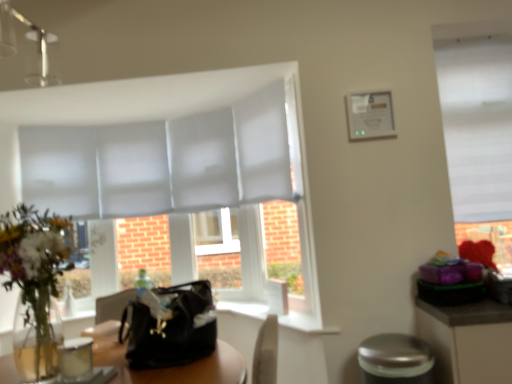
Describe the element at coordinates (305, 324) in the screenshot. I see `white smooth window sill at center` at that location.

At what (x,y) coordinates should I click in order to perform the action: click on translucent glass vase at left. Please return your answer as a coordinate pair (x, y). Looking at the image, I should click on (35, 280).

What do you see at coordinates (35, 280) in the screenshot? This screenshot has height=384, width=512. I see `translucent glass vase at left` at bounding box center [35, 280].

Describe the element at coordinates (478, 127) in the screenshot. The image size is (512, 384). I see `white matte window at upper right` at that location.

Locate an element on the screen. silver metallic bar stool at lower right is located at coordinates (395, 359).

Find the location of a particular element. Image resolution: width=512 pixels, height=384 pixels. white smooth window sill at center is located at coordinates (305, 324).

Can you confirm if black leather handbag at center is taller than translucent glass vase at left?

Incorrect, the height of black leather handbag at center is not larger of that of translucent glass vase at left.

Would you say black leather handbag at center contains translucent glass vase at left?

No, translucent glass vase at left is not inside black leather handbag at center.

Consider the image. Considering the relative sizes of black leather handbag at center and translucent glass vase at left in the image provided, is black leather handbag at center smaller than translucent glass vase at left?

Correct, black leather handbag at center occupies less space than translucent glass vase at left.

Is black leather handbag at center far from translucent glass vase at left?

No, there isn't a large distance between black leather handbag at center and translucent glass vase at left.

From the image's perspective, between white matte window at upper right and black leather handbag at center, which one is located above?

white matte window at upper right appears higher in the image.

Which point is more forward, (479, 148) or (202, 280)?

The point (202, 280) is more forward.

From a real-world perspective, is white matte window at upper right below black leather handbag at center?

No, from a real-world perspective, white matte window at upper right is not beneath black leather handbag at center.

In the scene shown: Is white matte window at upper right wider or thinner than black leather handbag at center?

Clearly, white matte window at upper right has less width compared to black leather handbag at center.

From a real-world perspective, relative to white matte window at upper right, is silver metallic bar stool at lower right vertically above or below?

silver metallic bar stool at lower right is situated lower than white matte window at upper right in the real world.

Consider the image. How many degrees apart are the facing directions of silver metallic bar stool at lower right and white matte window at upper right?

The angle between the facing direction of silver metallic bar stool at lower right and the facing direction of white matte window at upper right is 0.185 degrees.

Is the surface of silver metallic bar stool at lower right in direct contact with white matte window at upper right?

There is a gap between silver metallic bar stool at lower right and white matte window at upper right.

Are white smooth window sill at center and black leather handbag at center beside each other?

No, white smooth window sill at center is not beside black leather handbag at center.

Between white smooth window sill at center and black leather handbag at center, which one has less height?

Standing shorter between the two is white smooth window sill at center.

Is white smooth window sill at center smaller than black leather handbag at center?

Correct, white smooth window sill at center occupies less space than black leather handbag at center.

Is point (327, 328) farther from camera compared to point (196, 285)?

Yes, it is behind point (196, 285).

Could black leather handbag at center be considered to be inside translucent glass vase at left?

No, translucent glass vase at left does not contain black leather handbag at center.

From a real-world perspective, who is located lower, translucent glass vase at left or black leather handbag at center?

black leather handbag at center.

From the image's perspective, is translucent glass vase at left under black leather handbag at center?

Actually, translucent glass vase at left appears above black leather handbag at center in the image.

Who is smaller, translucent glass vase at left or black leather handbag at center?

black leather handbag at center.

Can you confirm if translucent glass vase at left is positioned to the left of white matte window at upper right?

Yes.

From a real-world perspective, which is physically below, translucent glass vase at left or white matte window at upper right?

In real-world perspective, translucent glass vase at left is lower.

Is there a large distance between translucent glass vase at left and white matte window at upper right?

Indeed, translucent glass vase at left is not near white matte window at upper right.

From a real-world perspective, is black leather handbag at center on top of white matte window at upper right?

No, from a real-world perspective, black leather handbag at center is not on top of white matte window at upper right.

Who is taller, black leather handbag at center or white matte window at upper right?

With more height is white matte window at upper right.

The width and height of the screenshot is (512, 384). What are the coordinates of `handbag in front of the white matte window at upper right` in the screenshot? It's located at (170, 325).

Is black leather handbag at center aimed at white matte window at upper right?

No, black leather handbag at center is not turned towards white matte window at upper right.

What are the coordinates of `floral arrangement located above the black leather handbag at center (from the image's perspective)` in the screenshot? It's located at (35, 280).

Where is `handbag below the white matte window at upper right (from a real-world perspective)`? The width and height of the screenshot is (512, 384). handbag below the white matte window at upper right (from a real-world perspective) is located at coordinates (170, 325).

Estimate the real-world distances between objects in this image. Which object is closer to white smooth window sill at center, silver metallic bar stool at lower right or translucent glass vase at left?

silver metallic bar stool at lower right is closer to white smooth window sill at center.

Looking at the image, which one is located closer to black leather handbag at center, translucent glass vase at left or silver metallic bar stool at lower right?

translucent glass vase at left lies closer to black leather handbag at center than the other object.

From the image, which object appears to be farther from silver metallic bar stool at lower right, white smooth window sill at center or translucent glass vase at left?

Based on the image, translucent glass vase at left appears to be further to silver metallic bar stool at lower right.

Looking at this image, based on their spatial positions, is translucent glass vase at left or white smooth window sill at center further from black leather handbag at center?

Based on the image, white smooth window sill at center appears to be further to black leather handbag at center.

Which object lies nearer to the anchor point white matte window at upper right, silver metallic bar stool at lower right or translucent glass vase at left?

Based on the image, silver metallic bar stool at lower right appears to be nearer to white matte window at upper right.

Which object lies further to the anchor point silver metallic bar stool at lower right, black leather handbag at center or translucent glass vase at left?

translucent glass vase at left.

When comparing their distances from white matte window at upper right, does black leather handbag at center or silver metallic bar stool at lower right seem further?

black leather handbag at center lies further to white matte window at upper right than the other object.

Which object lies nearer to the anchor point translucent glass vase at left, silver metallic bar stool at lower right or white matte window at upper right?

Based on the image, silver metallic bar stool at lower right appears to be nearer to translucent glass vase at left.

I want to click on handbag located between translucent glass vase at left and silver metallic bar stool at lower right in the left-right direction, so click(x=170, y=325).

This screenshot has width=512, height=384. What are the coordinates of `window sill situated between black leather handbag at center and silver metallic bar stool at lower right from left to right` in the screenshot? It's located at (305, 324).

You are a GUI agent. You are given a task and a screenshot of the screen. Output one action in this format:
    pyautogui.click(x=<x>, y=<y>)
    Task: Click on the bar stool between white smooth window sill at center and white matte window at upper right in the horizontal direction
    The image size is (512, 384).
    Given the screenshot: What is the action you would take?
    pyautogui.click(x=395, y=359)

Where is `bar stool between translucent glass vase at left and white matte window at upper right in the horizontal direction`? bar stool between translucent glass vase at left and white matte window at upper right in the horizontal direction is located at coordinates (395, 359).